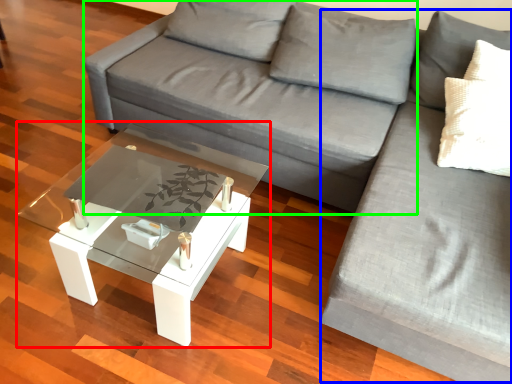
Question: Which object is positioned farthest from coffee table (highlighted by a red box)? Select from couch (highlighted by a blue box) and couch (highlighted by a green box).

Choices:
 (A) couch
 (B) couch

Answer: (A)